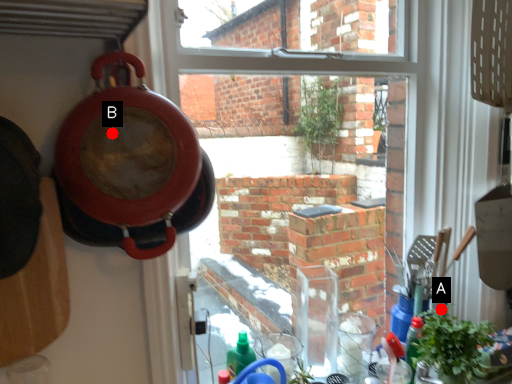
Question: Two points are circled on the image, labeled by A and B beside each circle. Which point appears farthest from the camera in this image?

Choices:
 (A) A is further
 (B) B is further

Answer: (A)